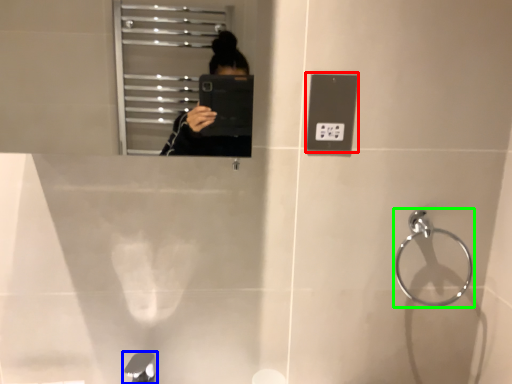
Question: Which object is positioned farthest from light switch (highlighted by a red box)? Select from tap (highlighted by a blue box) and towel bar (highlighted by a green box).

Choices:
 (A) tap
 (B) towel bar

Answer: (A)